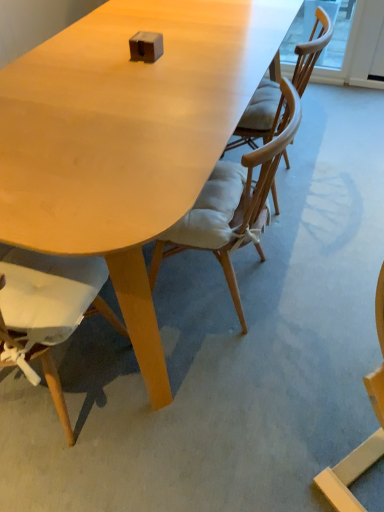
Image resolution: width=384 pixels, height=512 pixels. Identify the location of vacant space in front of light brown wood chair at center, which is counted as the 2th chair, starting from the right. (220, 390).